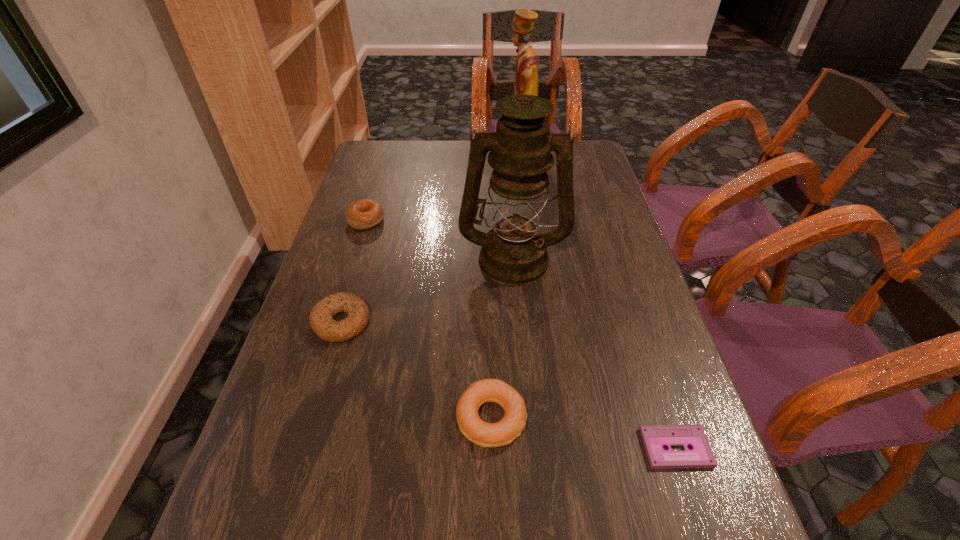
The height and width of the screenshot is (540, 960). I want to click on vacant space situated on the left of the third farthest object, so click(x=393, y=258).

What are the coordinates of `vacant space located 0.270m on the back of the farthest bagel` in the screenshot? It's located at 384,163.

Find the location of a particular element. Image resolution: width=960 pixels, height=540 pixels. free location located on the left of the rightmost bagel is located at coordinates (385, 418).

At what (x,y) coordinates should I click in order to perform the action: click on free space located 0.290m on the front of the second nearest bagel. Please return your answer as a coordinate pair (x, y). The image size is (960, 540). Looking at the image, I should click on [292, 490].

You are a GUI agent. You are given a task and a screenshot of the screen. Output one action in this format:
    pyautogui.click(x=<x>, y=<y>)
    Task: Click on the vacant space located on the front of the videotape
    
    Given the screenshot: What is the action you would take?
    pyautogui.click(x=695, y=508)

At what (x,y) coordinates should I click in order to perform the action: click on object positioned at the far edge. Please return your answer as a coordinate pair (x, y). Looking at the image, I should click on (526, 80).

Find the location of a particular element. object that is at the right edge is located at coordinates (655, 437).

Find the location of `vacant space at the left edge of the desktop`. vacant space at the left edge of the desktop is located at coordinates (336, 408).

Identify the location of blank space at the right edge. (598, 267).

Locate an element on the screen. This screenshot has height=540, width=960. vacant region at the far left corner of the desktop is located at coordinates point(403,150).